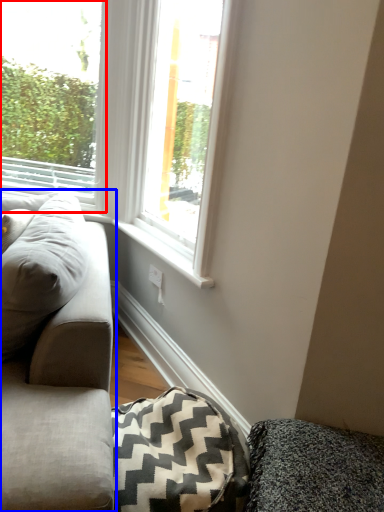
Question: Which object is further to the camera taking this photo, window (highlighted by a red box) or studio couch (highlighted by a blue box)?

Choices:
 (A) window
 (B) studio couch

Answer: (A)